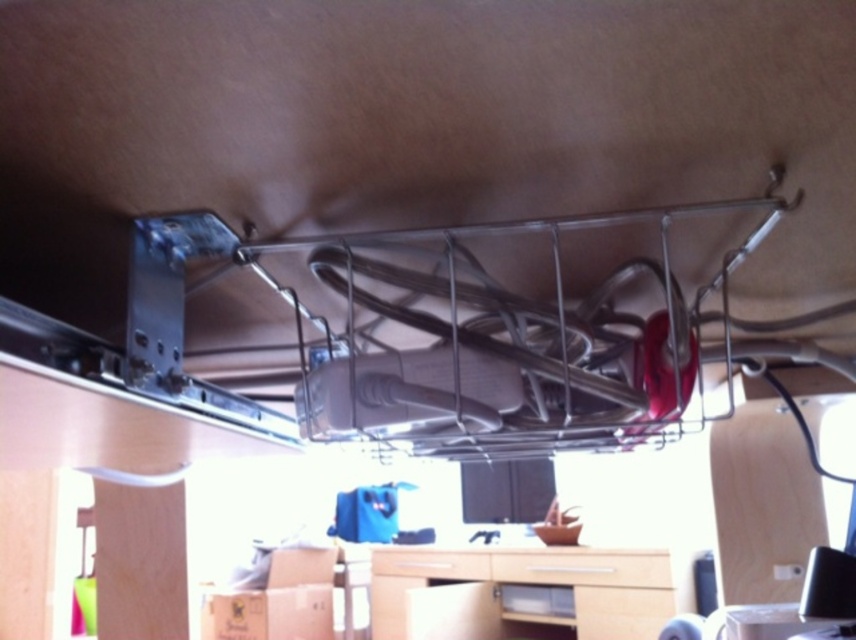
Between light wood/wooden computer desk at lower center and wooden drawer at center, which one has more height?

→ light wood/wooden computer desk at lower center

Does light wood/wooden computer desk at lower center come in front of wooden drawer at center?

Yes, it is in front of wooden drawer at center.

Which is in front, point (492, 547) or point (381, 556)?

Point (492, 547) is in front.

Locate an element on the screen. Image resolution: width=856 pixels, height=640 pixels. light wood/wooden computer desk at lower center is located at coordinates (526, 589).

The width and height of the screenshot is (856, 640). Identify the location of light wood/wooden computer desk at lower center. (526, 589).

Which is in front, point (415, 561) or point (657, 554)?

Positioned in front is point (657, 554).

Locate an element on the screen. This screenshot has height=640, width=856. light wood/wooden computer desk at lower center is located at coordinates (526, 589).

Who is more forward, [648,557] or [470,554]?

Positioned in front is point [648,557].

Measure the distance between matte wood drawer at center and camera.

9.06 feet

Find the location of a particular element. matte wood drawer at center is located at coordinates (584, 568).